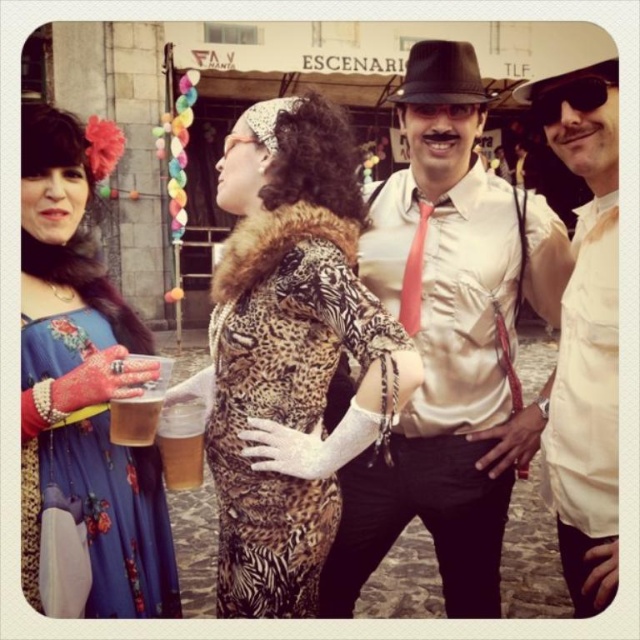
Question: Which point appears closest to the camera in this image?

Choices:
 (A) [154, 403]
 (B) [241, 497]
 (C) [460, 440]
 (D) [33, 561]

Answer: (D)

Question: Considering the real-world distances, which object is closest to the leopard print dress at center?

Choices:
 (A) translucent plastic cup at center
 (B) white cotton shirt at center

Answer: (A)

Question: Which object appears closest to the camera in this image?

Choices:
 (A) silky white shirt at center
 (B) blue floral dress at left
 (C) white cotton shirt at center
 (D) translucent plastic cup at center

Answer: (B)

Question: Observing the image, what is the correct spatial positioning of translucent plastic cup at center in reference to translucent plastic cup at lower left?

Choices:
 (A) above
 (B) below

Answer: (B)

Question: Is silky white shirt at center bigger than translucent plastic cup at lower left?

Choices:
 (A) no
 (B) yes

Answer: (B)

Question: Does white cotton shirt at center appear on the right side of translucent plastic cup at center?

Choices:
 (A) no
 (B) yes

Answer: (B)